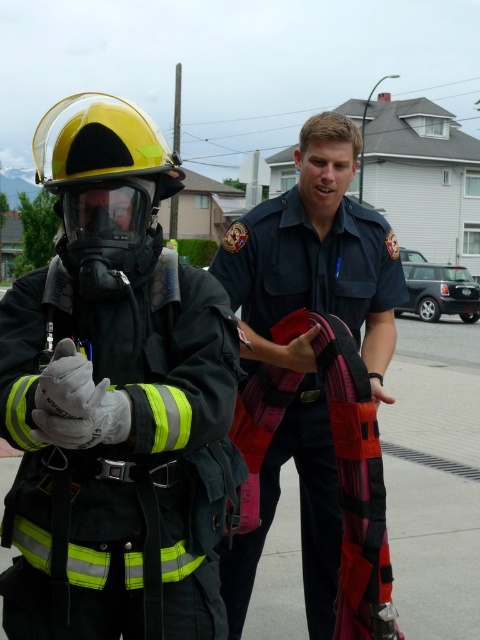
Where is the reflective black helmet at upper left located in the image?

The reflective black helmet at upper left is located at point coordinates of (x=115, y=401).

You are a safety inspector evaluating the equipment of two emergency responders in a suburban area. You observe the reflective black helmet at upper left and the dark blue uniform at center. Which item has a smaller width?

The reflective black helmet at upper left has a lesser width compared to the dark blue uniform at center, so the reflective black helmet at upper left is smaller in width.

You are a drone operator trying to capture a clear photo of the dark blue uniform at center and the reflective black helmet at upper left. Which object should you focus on first to ensure both are in frame?

The reflective black helmet at upper left is positioned under the dark blue uniform at center, so you should focus on the dark blue uniform at center first to ensure both are in frame.